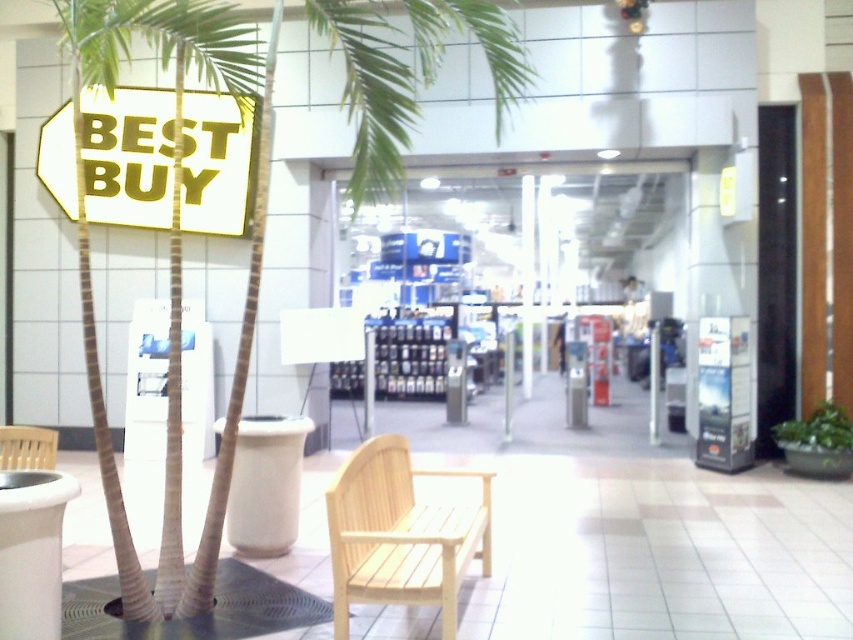
Does white matte sign at upper left appear under metallic pole at center?

No.

Which is more to the left, white matte sign at upper left or metallic pole at center?

From the viewer's perspective, white matte sign at upper left appears more on the left side.

Between point (148, 132) and point (531, 205), which one is positioned in front?

Point (148, 132) is in front.

Where is `white matte sign at upper left`? The width and height of the screenshot is (853, 640). white matte sign at upper left is located at coordinates (128, 156).

Does point (527, 364) come farther from viewer compared to point (16, 428)?

Yes, point (527, 364) is farther from viewer.

Is metallic pole at center to the left of wooden bench at lower left from the viewer's perspective?

Incorrect, metallic pole at center is not on the left side of wooden bench at lower left.

The height and width of the screenshot is (640, 853). Identify the location of metallic pole at center. pos(527,280).

Does point (468, 164) come in front of point (529, 324)?

Yes, it is.

Find the location of a particular element. Image resolution: width=853 pixels, height=640 pixels. matte plastic shelves at center is located at coordinates (537, 228).